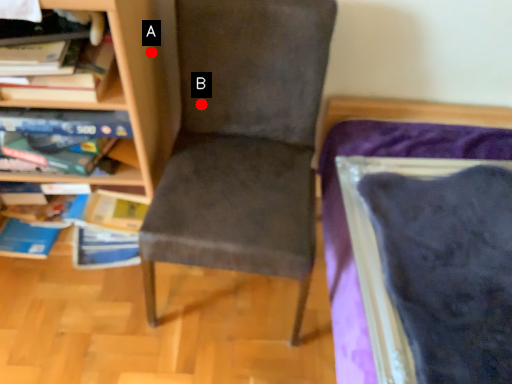
Question: Two points are circled on the image, labeled by A and B beside each circle. Which point is closer to the camera?

Choices:
 (A) A is closer
 (B) B is closer

Answer: (A)